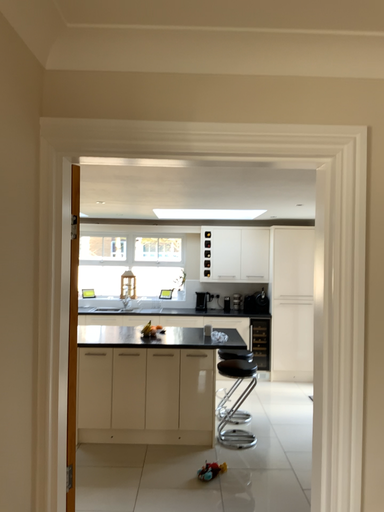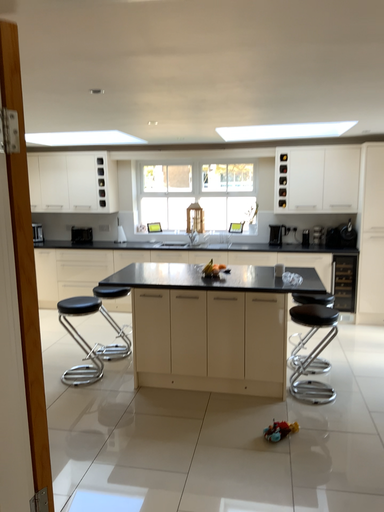
Question: Which way did the camera rotate in the video?

Choices:
 (A) rotated upward
 (B) rotated downward

Answer: (B)